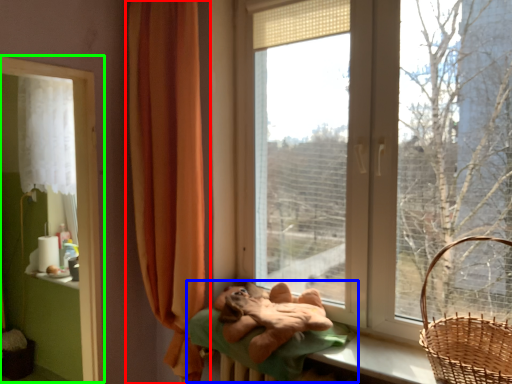
Question: Based on their relative distances, which object is nearer to curtain (highlighted by a red box)? Choose from bed (highlighted by a blue box) and window frame (highlighted by a green box).

Choices:
 (A) bed
 (B) window frame

Answer: (B)